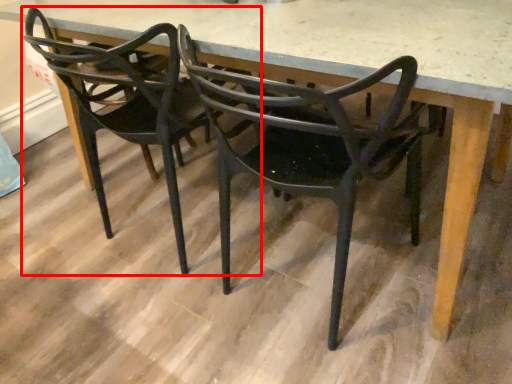
Question: From the image's perspective, what is the correct spatial positioning of chair (annotated by the red box) in reference to chair?

Choices:
 (A) below
 (B) above

Answer: (B)